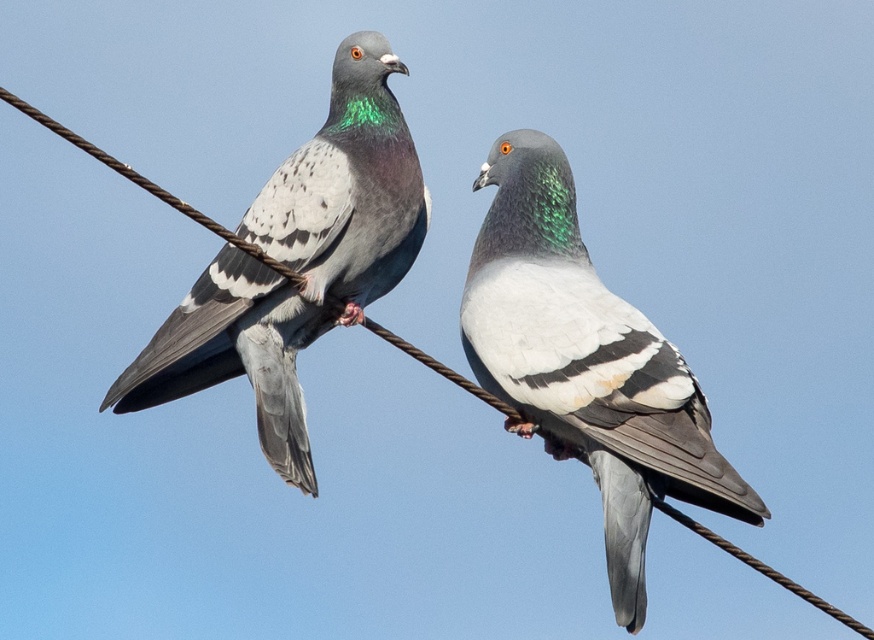
Question: Can you confirm if matte gray pigeon at center is thinner than matte gray pigeon at left?

Choices:
 (A) no
 (B) yes

Answer: (A)

Question: Which of the following is the farthest from the observer?

Choices:
 (A) (595, 337)
 (B) (403, 260)

Answer: (B)

Question: Is matte gray pigeon at center above matte gray pigeon at left?

Choices:
 (A) yes
 (B) no

Answer: (B)

Question: Can you confirm if matte gray pigeon at center is positioned to the right of matte gray pigeon at left?

Choices:
 (A) no
 (B) yes

Answer: (B)

Question: Which point is farther from the camera taking this photo?

Choices:
 (A) (195, 292)
 (B) (569, 349)

Answer: (A)